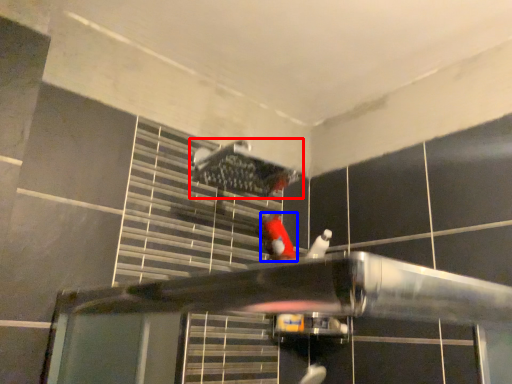
Question: Which of the following is the farthest to the observer, shower (highlighted by a red box) or person (highlighted by a blue box)?

Choices:
 (A) shower
 (B) person

Answer: (B)